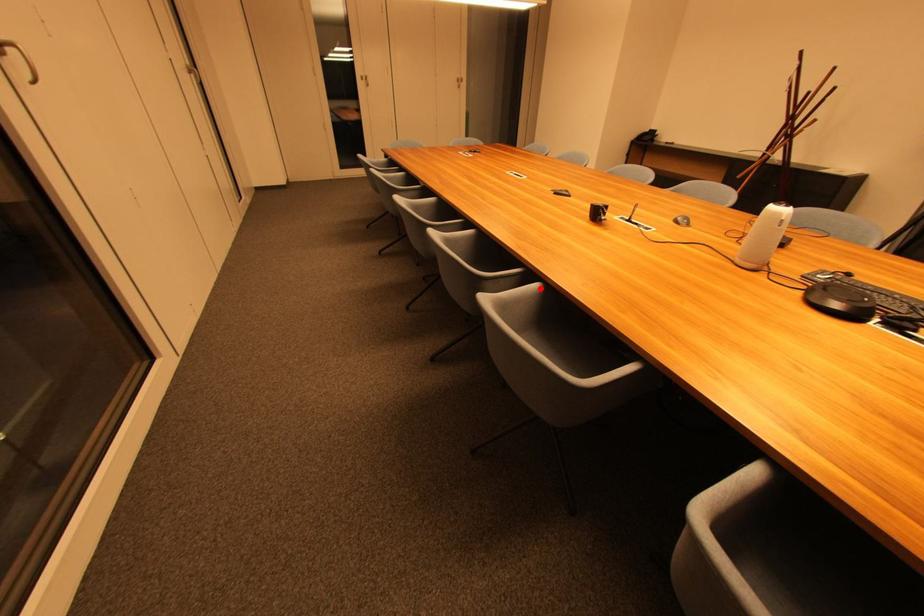
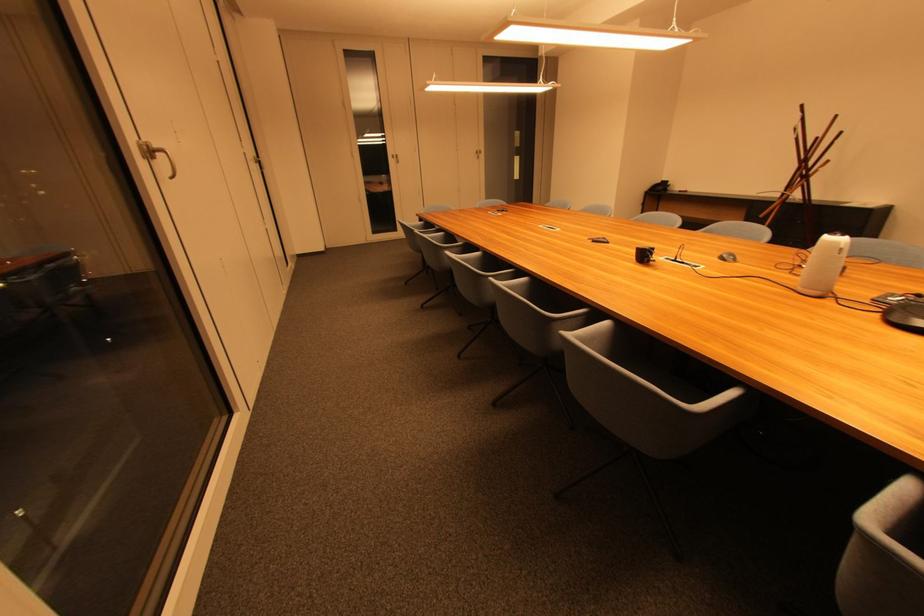
Where in the second image is the point corresponding to the highlighted location from the first image?

(612, 325)